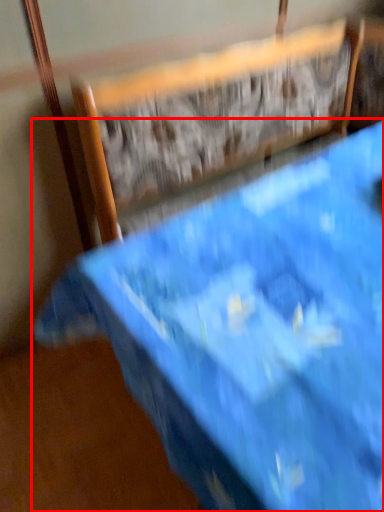
Question: Where is furniture (annotated by the red box) located in relation to chair in the image?

Choices:
 (A) right
 (B) left

Answer: (A)